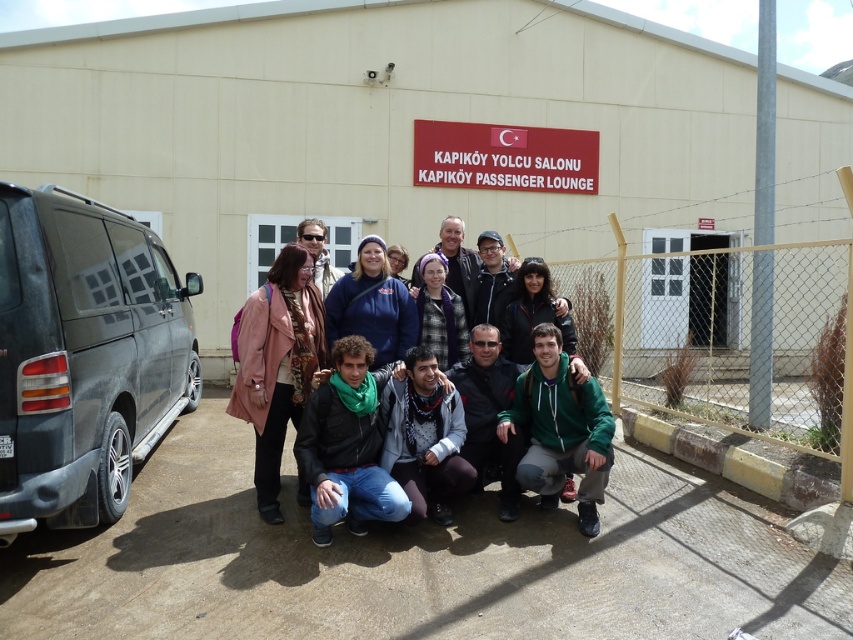
In the scene shown: You are a photographer trying to capture a clear shot of both the green fleece jacket at center and the matte black jacket at center. Since both are in the center, which one will appear larger in your photo?

The green fleece jacket at center appears larger in the photo because it is closer to the viewer than the matte black jacket at center.